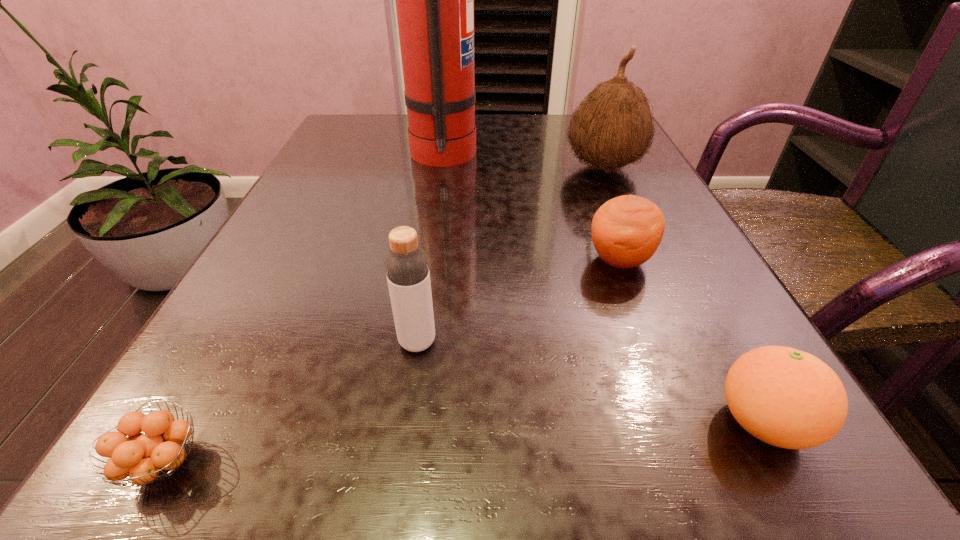
You are a GUI agent. You are given a task and a screenshot of the screen. Output one action in this format:
    pyautogui.click(x=<x>, y=<y>)
    Task: Click on the fire extinguisher
    The image size is (960, 540).
    Given the screenshot: What is the action you would take?
    pyautogui.click(x=434, y=0)

The height and width of the screenshot is (540, 960). I want to click on the fifth shortest object, so click(612, 128).

I want to click on the third tallest object, so click(x=406, y=264).

The image size is (960, 540). Find the location of `bottle`. bottle is located at coordinates (406, 264).

The width and height of the screenshot is (960, 540). I want to click on the farthest orange fruit, so click(x=626, y=231).

I want to click on the leftmost object, so click(x=154, y=454).

Identify the location of the leftmost orange fruit. pyautogui.click(x=154, y=454).

Image resolution: width=960 pixels, height=540 pixels. What are the coordinates of `free space located 0.210m on the label side of the fire extinguisher` in the screenshot? It's located at (575, 156).

Locate an element on the screen. vacant space located 0.270m on the surface of the second tallest object is located at coordinates (430, 167).

The height and width of the screenshot is (540, 960). I want to click on free space located 0.300m on the surface of the second tallest object, so click(415, 167).